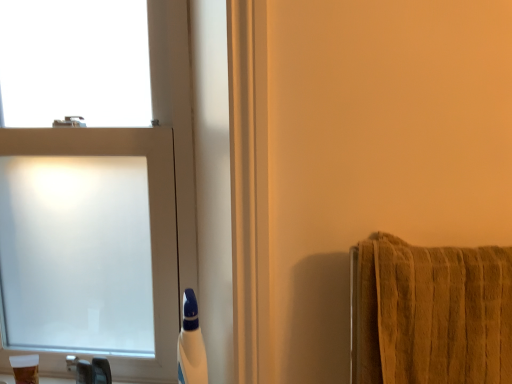
Question: Does white plastic bottle at lower center, the first toiletry in the right-to-left sequence, appear on the left side of translucent plastic cup at lower left, positioned as the first toiletry in left-to-right order?

Choices:
 (A) no
 (B) yes

Answer: (A)

Question: Does white plastic bottle at lower center, the first toiletry in the right-to-left sequence, have a lesser height compared to translucent plastic cup at lower left, positioned as the first toiletry in left-to-right order?

Choices:
 (A) yes
 (B) no

Answer: (B)

Question: Is white plastic bottle at lower center, which is the second toiletry from left to right, beside translucent plastic cup at lower left, positioned as the first toiletry in left-to-right order?

Choices:
 (A) yes
 (B) no

Answer: (B)

Question: Would you consider white plastic bottle at lower center, which is the second toiletry from left to right, to be distant from translucent plastic cup at lower left, positioned as the first toiletry in left-to-right order?

Choices:
 (A) no
 (B) yes

Answer: (A)

Question: Is white plastic bottle at lower center, the first toiletry in the right-to-left sequence, thinner than translucent plastic cup at lower left, arranged as the second toiletry when viewed from the right?

Choices:
 (A) no
 (B) yes

Answer: (A)

Question: From a real-world perspective, is white plastic bottle at lower center, which is the second toiletry from left to right, below translucent plastic cup at lower left, arranged as the second toiletry when viewed from the right?

Choices:
 (A) no
 (B) yes

Answer: (A)

Question: Is translucent plastic cup at lower left, arranged as the second toiletry when viewed from the right, not within white plastic bottle at lower center, the first toiletry in the right-to-left sequence?

Choices:
 (A) no
 (B) yes

Answer: (B)

Question: Is translucent plastic cup at lower left, positioned as the first toiletry in left-to-right order, smaller than white plastic bottle at lower center, the first toiletry in the right-to-left sequence?

Choices:
 (A) no
 (B) yes

Answer: (B)

Question: Is translucent plastic cup at lower left, arranged as the second toiletry when viewed from the right, bigger than white plastic bottle at lower center, which is the second toiletry from left to right?

Choices:
 (A) yes
 (B) no

Answer: (B)

Question: From a real-world perspective, is translucent plastic cup at lower left, arranged as the second toiletry when viewed from the right, located beneath white plastic bottle at lower center, the first toiletry in the right-to-left sequence?

Choices:
 (A) yes
 (B) no

Answer: (A)

Question: Considering the relative sizes of translucent plastic cup at lower left, positioned as the first toiletry in left-to-right order, and white plastic bottle at lower center, the first toiletry in the right-to-left sequence, in the image provided, is translucent plastic cup at lower left, positioned as the first toiletry in left-to-right order, shorter than white plastic bottle at lower center, the first toiletry in the right-to-left sequence,?

Choices:
 (A) no
 (B) yes

Answer: (B)

Question: From the image's perspective, is translucent plastic cup at lower left, arranged as the second toiletry when viewed from the right, above white plastic bottle at lower center, the first toiletry in the right-to-left sequence?

Choices:
 (A) yes
 (B) no

Answer: (B)

Question: Are translucent plastic cup at lower left, arranged as the second toiletry when viewed from the right, and frosted glass window at left located far from each other?

Choices:
 (A) no
 (B) yes

Answer: (A)